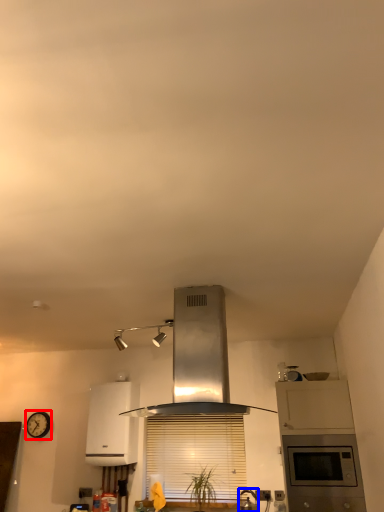
Question: Which of the following is the farthest to the observer, clock (highlighted by a red box) or kitchen appliance (highlighted by a blue box)?

Choices:
 (A) clock
 (B) kitchen appliance

Answer: (A)